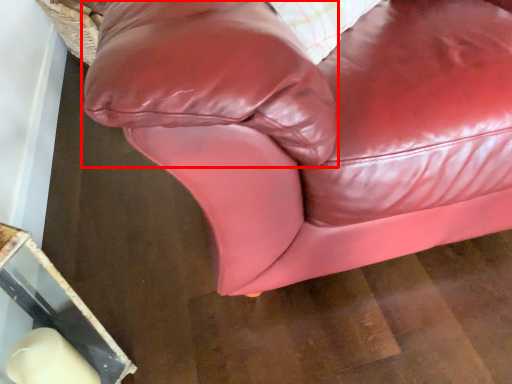
Question: From the image's perspective, considering the relative positions of pillow (annotated by the red box) and studio couch in the image provided, where is pillow (annotated by the red box) located with respect to the staircase?

Choices:
 (A) above
 (B) below

Answer: (A)